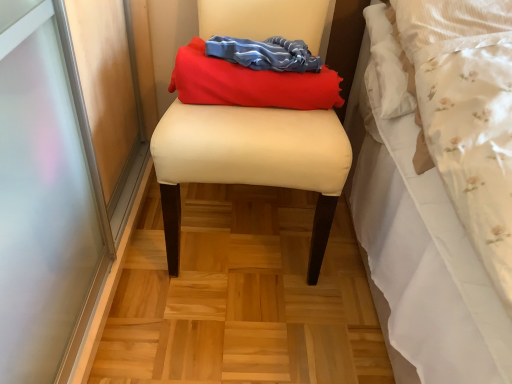
Image resolution: width=512 pixels, height=384 pixels. What are the coordinates of `vacant area in front of beige fabric stool at center` in the screenshot? It's located at (240, 326).